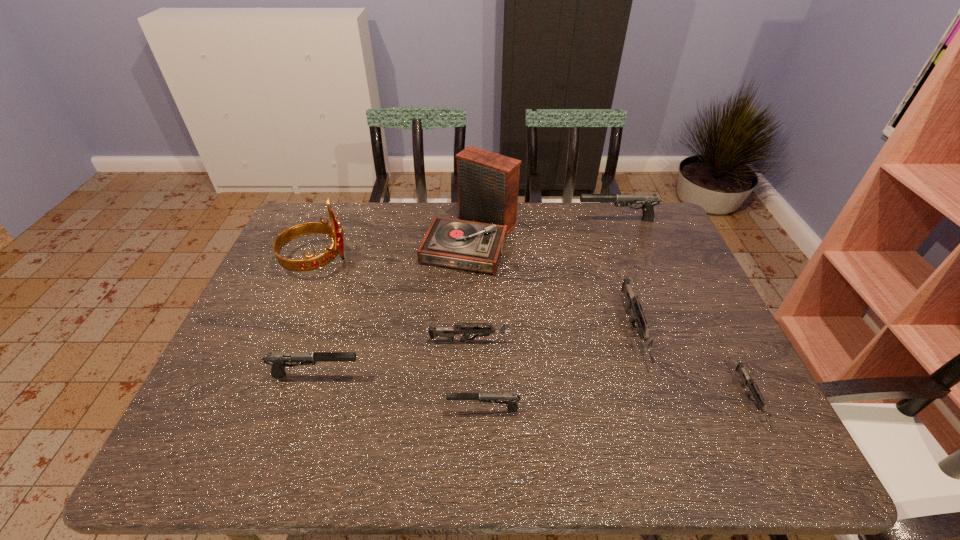
I want to click on the seventh closest object to the leftmost grey gun, so click(649, 201).

Identify which gun is the nearest to the leftmost gray gun. Please provide its 2D coordinates. Your answer should be formatted as a tuple, i.e. [(x, y)], where the tuple contains the x and y coordinates of a point satisfying the conditions above.

[(449, 332)]

Identify which gun is located as the fifth nearest to the leftmost gun. Please provide its 2D coordinates. Your answer should be formatted as a tuple, i.e. [(x, y)], where the tuple contains the x and y coordinates of a point satisfying the conditions above.

[(746, 380)]

This screenshot has height=540, width=960. I want to click on the third closest gray gun to the biggest grey gun, so click(x=277, y=360).

Identify which gray gun is the second nearest to the tiara. Please provide its 2D coordinates. Your answer should be formatted as a tuple, i.e. [(x, y)], where the tuple contains the x and y coordinates of a point satisfying the conditions above.

[(510, 399)]

Identify the location of grey gun that is the third closest to the second farthest gray gun. (746, 380).

Identify which grey gun is the second nearest to the second smallest grey gun. Please provide its 2D coordinates. Your answer should be formatted as a tuple, i.e. [(x, y)], where the tuple contains the x and y coordinates of a point satisfying the conditions above.

[(746, 380)]

Locate an element on the screen. vacant area that satisfies the following two spatial constraints: 1. aimed along the barrel of the rightmost grey gun; 2. at the muzzle end of the second gray gun from left to right is located at coordinates (754, 410).

Locate an element on the screen. The width and height of the screenshot is (960, 540). free region that satisfies the following two spatial constraints: 1. aimed along the barrel of the biggest grey gun; 2. aimed along the barrel of the leftmost grey gun is located at coordinates (637, 341).